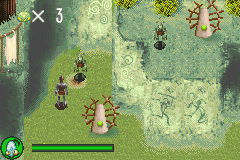
Find the location of a particular element. The height and width of the screenshot is (160, 240). bar is located at coordinates point(108,145).